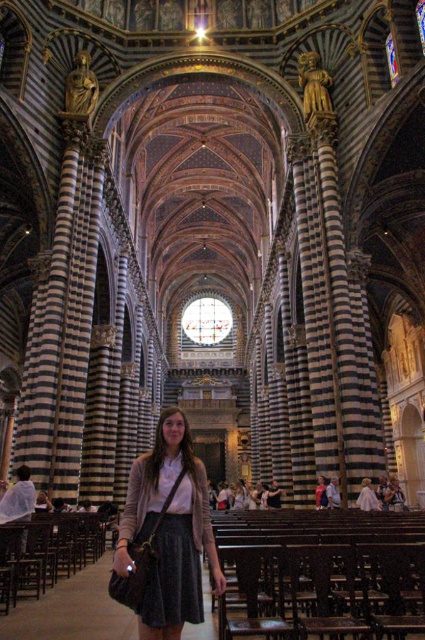
You are attending a wedding ceremony in this cathedral and notice two guests wearing a matte black skirt at center and a matte white dress at center. Which guest has a wider lower body garment?

The matte black skirt at center is wider than the matte white dress at center.

You are a tour guide leading a group through the cathedral. You notice two visitors, one wearing a matte black skirt at center and another wearing a matte white dress at center. You want to ensure they can hear your explanation about the ribbed vaults. If your voice carries 30 meters, will they both hear you clearly from where they are standing?

The distance between the matte black skirt at center and the matte white dress at center is 27.98 meters. Since your voice carries 30 meters, both visitors will be within the range and can hear your explanation clearly.